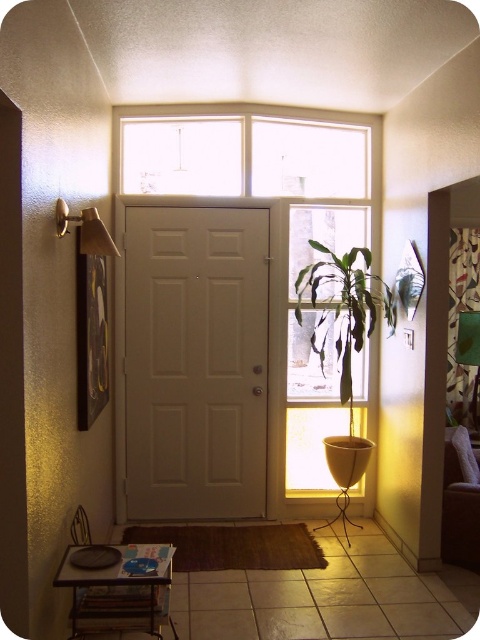
You are trying to locate the door handle to exit the room. Based on the scene, where is the metallic brass door handle at upper left in relation to the translucent glass window at center?

The metallic brass door handle at upper left is to the left of the translucent glass window at center.

You are a delivery person trying to reach the door handle. Given that the white matte door at center is taller than the metallic brass door handle at upper left, will you need to adjust your reach to open the door?

The white matte door at center is taller than the metallic brass door handle at upper left, so you will need to reach higher to grasp the metallic brass door handle at upper left since it is positioned higher up on the taller door.

You are standing in the hallway and want to check if the translucent glass window at center is directly in front of you. Based on the coordinates provided, is the window centered horizontally in the image?

The translucent glass window at center is located at coordinates point (317, 342), which means it is nearly centered horizontally since the x coordinate is close to 0.5. Therefore, it is directly in front of you.